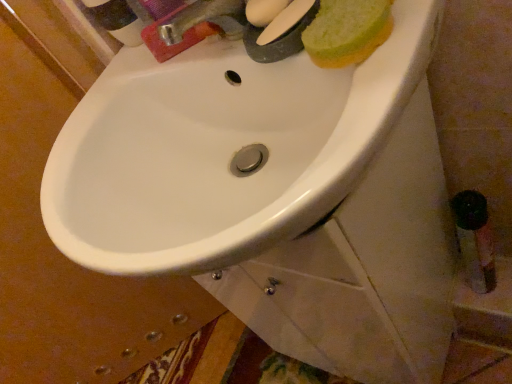
Question: Is green sponge at upper right taller or shorter than white glossy sink at center?

Choices:
 (A) short
 (B) tall

Answer: (A)

Question: Choose the correct answer: Is green sponge at upper right inside white glossy sink at center or outside it?

Choices:
 (A) outside
 (B) inside

Answer: (A)

Question: Considering the real-world distances, which object is farthest from the metallic silver faucet at upper center?

Choices:
 (A) green sponge at upper right
 (B) white glossy sink at center

Answer: (B)

Question: Estimate the real-world distances between objects in this image. Which object is closer to the metallic silver faucet at upper center?

Choices:
 (A) white glossy sink at center
 (B) green sponge at upper right

Answer: (B)